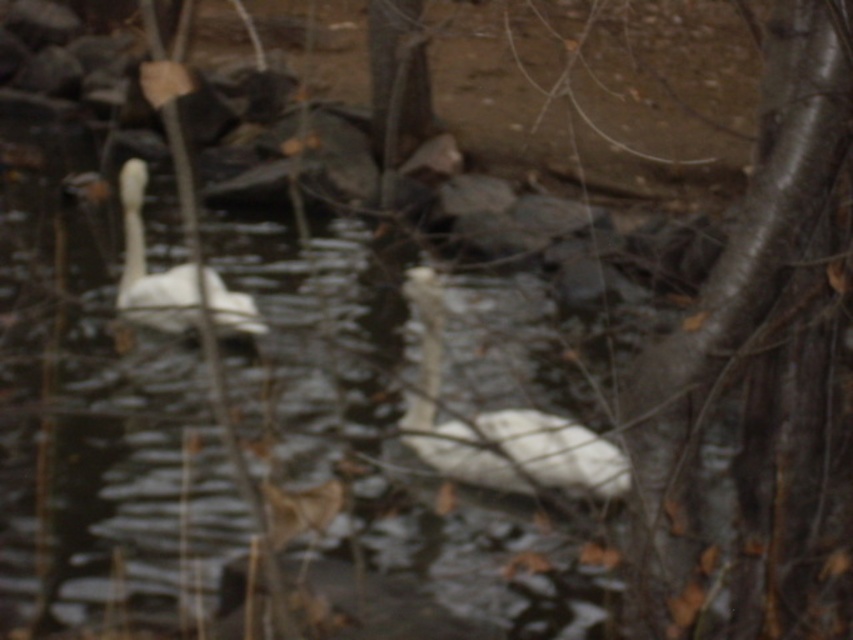
Question: Does white matte swan at center appear under white matte swan at upper left?

Choices:
 (A) no
 (B) yes

Answer: (B)

Question: Is white matte swan at center to the right of white matte swan at upper left from the viewer's perspective?

Choices:
 (A) no
 (B) yes

Answer: (B)

Question: Which object appears closest to the camera in this image?

Choices:
 (A) white matte swan at center
 (B) white matte swan at upper left

Answer: (A)

Question: Which point appears farthest from the camera in this image?

Choices:
 (A) (569, 483)
 (B) (227, 296)

Answer: (B)

Question: Is white matte swan at center thinner than white matte swan at upper left?

Choices:
 (A) no
 (B) yes

Answer: (B)

Question: Among these points, which one is farthest from the camera?

Choices:
 (A) (563, 449)
 (B) (134, 230)

Answer: (B)